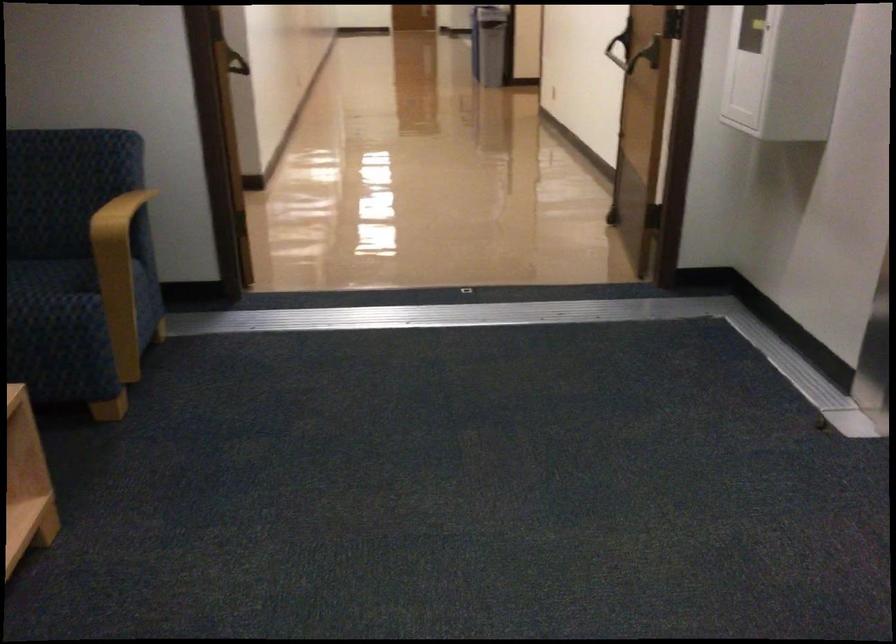
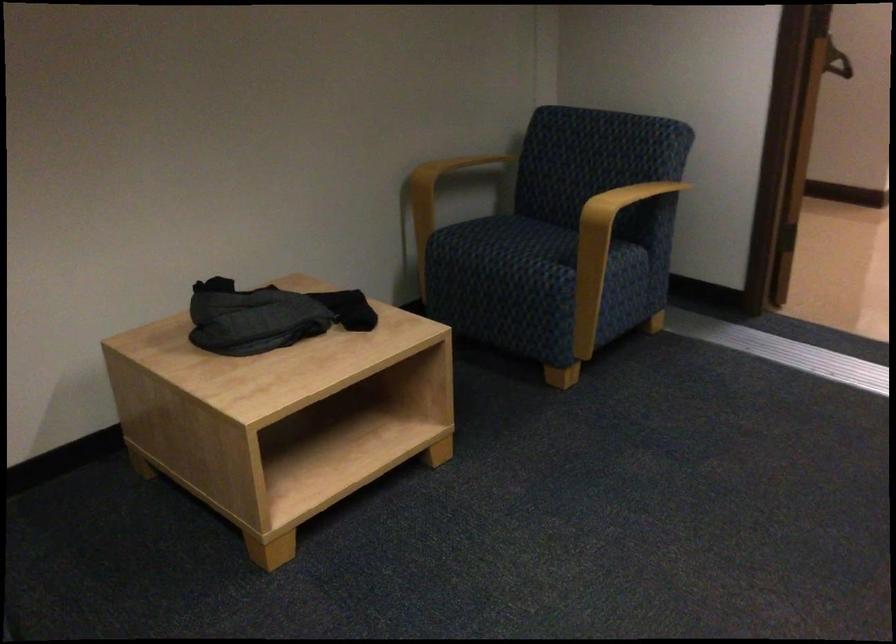
Question: How did the camera likely rotate?

Choices:
 (A) Left
 (B) Right
 (C) Up
 (D) Down

Answer: (A)